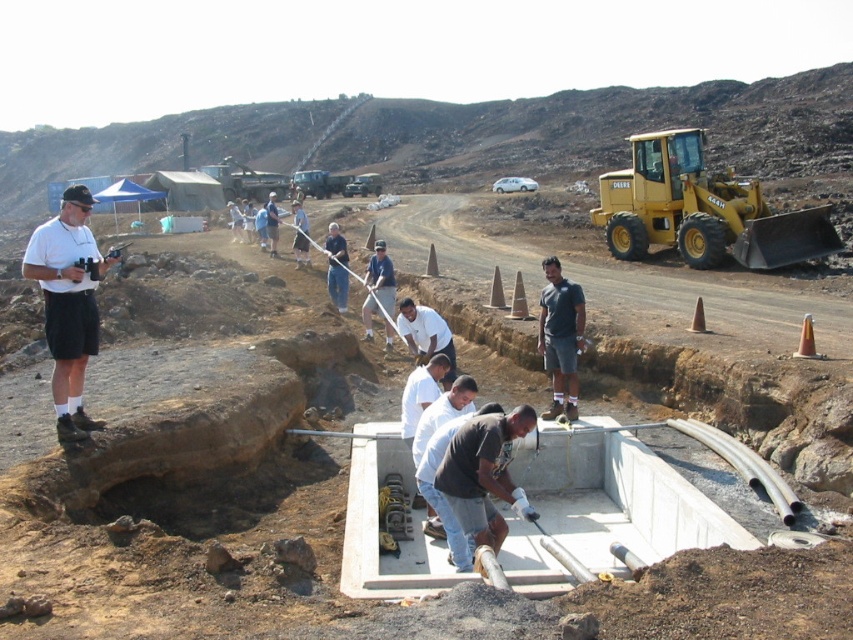
You are a construction engineer assessing the site layout. You need to place a new equipment storage container that must be wider than the white concrete foundation at center. Can the container be placed next to the yellow rubber tractor at upper right without exceeding its width?

The white concrete foundation at center is narrower than the yellow rubber tractor at upper right. Since the storage container needs to be wider than the white concrete foundation at center, it can be placed next to the yellow rubber tractor at upper right as the tractor is wider, providing sufficient space.

You are a safety inspector at the construction site and you need to locate the worker wearing a dark gray shirt at center. According to the coordinates provided, where exactly would you find this worker in the image?

The dark gray shirt at center is located at point (482,474).

You are a construction supervisor who needs to transport materials from the yellow rubber tractor at upper right to the white concrete foundation at center. Given their sizes, which object requires more space to maneuver around?

The yellow rubber tractor at upper right requires more space to maneuver around since it is larger than the white concrete foundation at center.